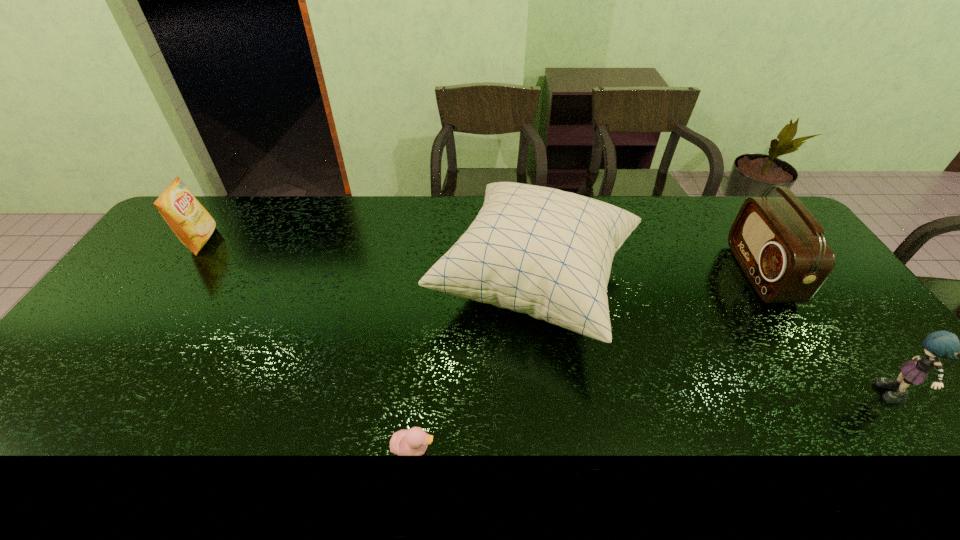
The image size is (960, 540). Identify the location of free space that is in between the fourth object from left to right and the duckling. (587, 361).

Find the location of a particular element. This screenshot has width=960, height=540. unoccupied area between the nearest object and the leftmost object is located at coordinates (307, 345).

What are the coordinates of `free area in between the cushion and the second nearest object` in the screenshot? It's located at (714, 341).

You are a GUI agent. You are given a task and a screenshot of the screen. Output one action in this format:
    pyautogui.click(x=<x>, y=<y>)
    Task: Click on the blank region between the fourth farthest object and the cushion
    The image size is (960, 540).
    Given the screenshot: What is the action you would take?
    pyautogui.click(x=714, y=341)

Where is `unoccupied position between the second nearest object and the cushion`? The height and width of the screenshot is (540, 960). unoccupied position between the second nearest object and the cushion is located at coordinates (714, 341).

Locate an element on the screen. vacant point located between the cushion and the crisp (potato chip) is located at coordinates (368, 262).

You are a GUI agent. You are given a task and a screenshot of the screen. Output one action in this format:
    pyautogui.click(x=<x>, y=<y>)
    Task: Click on the object identified as the third closest to the rag doll
    
    Given the screenshot: What is the action you would take?
    pyautogui.click(x=406, y=442)

Locate which object is the closest to the shortest object. Please provide its 2D coordinates. Your answer should be formatted as a tuple, i.e. [(x, y)], where the tuple contains the x and y coordinates of a point satisfying the conditions above.

[(545, 252)]

Where is `vacant space that satisfies the following two spatial constraints: 1. on the front-facing side of the leftmost object; 2. on the back side of the cushion`? vacant space that satisfies the following two spatial constraints: 1. on the front-facing side of the leftmost object; 2. on the back side of the cushion is located at coordinates (172, 285).